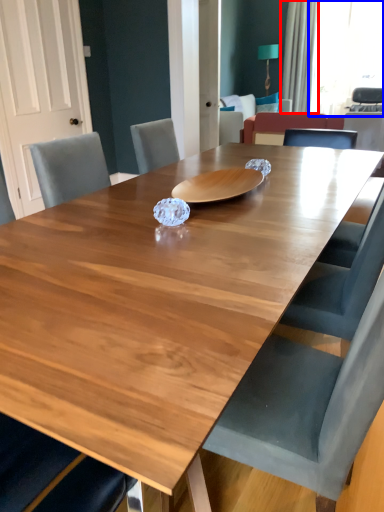
Question: Which object is closer to the camera taking this photo, curtain (highlighted by a red box) or window screen (highlighted by a blue box)?

Choices:
 (A) curtain
 (B) window screen

Answer: (A)